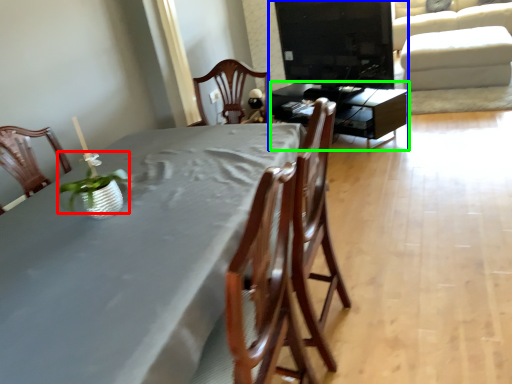
Question: Which object is the farthest from plant (highlighted by a red box)? Choose among these: entertainment center (highlighted by a blue box) or table (highlighted by a green box).

Choices:
 (A) entertainment center
 (B) table

Answer: (A)